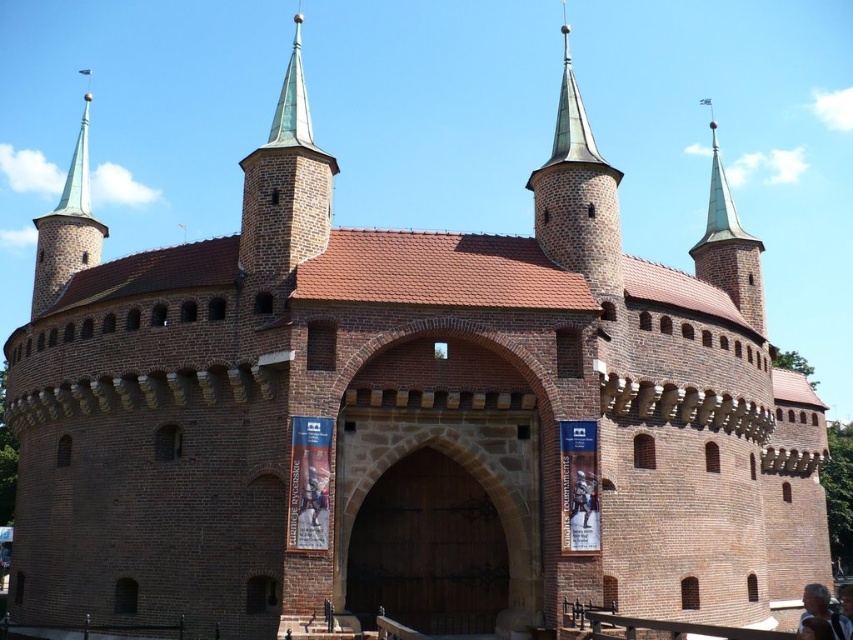
Is point (619, 298) positioned after point (842, 624)?

That is True.

Looking at this image, is green copper spire at upper center smaller than light brown hair at lower right?

Incorrect, green copper spire at upper center is not smaller in size than light brown hair at lower right.

The image size is (853, 640). In order to click on green copper spire at upper center in this screenshot , I will do `click(578, 195)`.

Locate an element on the screen. This screenshot has height=640, width=853. green copper spire at upper center is located at coordinates (578, 195).

Who is more forward, (x=610, y=264) or (x=79, y=156)?

Point (x=610, y=264)

This screenshot has width=853, height=640. Find the location of `green copper spire at upper center`. green copper spire at upper center is located at coordinates (578, 195).

Is green copper spire at upper left smaller than light brown hair at lower right?

No.

Can you confirm if green copper spire at upper left is shorter than light brown hair at lower right?

No.

Who is more forward, (70, 234) or (828, 598)?

Point (828, 598)

Identify the location of green copper spire at upper left. The image size is (853, 640). point(67,228).